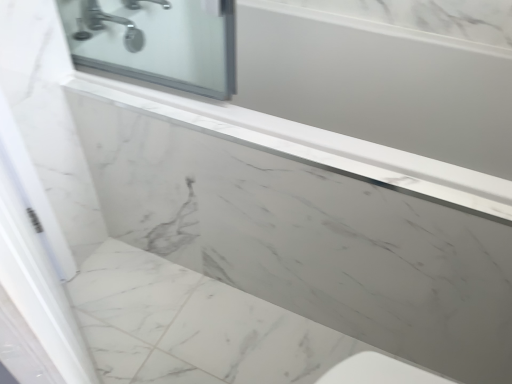
Question: From a real-world perspective, relative to silver metallic faucet at upper left, is white marble screen door at left vertically above or below?

Choices:
 (A) above
 (B) below

Answer: (B)

Question: Is point (47, 266) positioned closer to the camera than point (95, 14)?

Choices:
 (A) farther
 (B) closer

Answer: (B)

Question: Would you say white marble screen door at left is inside or outside silver metallic faucet at upper left?

Choices:
 (A) inside
 (B) outside

Answer: (B)

Question: Is silver metallic faucet at upper left bigger or smaller than white marble screen door at left?

Choices:
 (A) big
 (B) small

Answer: (B)

Question: From the image's perspective, is silver metallic faucet at upper left above or below white marble screen door at left?

Choices:
 (A) above
 (B) below

Answer: (A)

Question: Is silver metallic faucet at upper left in front of or behind white marble screen door at left in the image?

Choices:
 (A) behind
 (B) front

Answer: (A)

Question: Based on their positions, is silver metallic faucet at upper left located to the left or right of white marble screen door at left?

Choices:
 (A) left
 (B) right

Answer: (A)